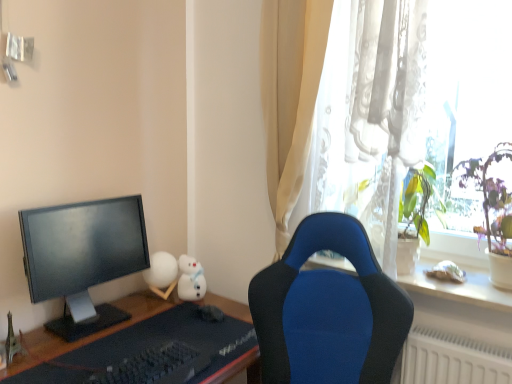
In order to click on free location above black matte desk at lower left (from a real-world perspective) in this screenshot , I will do `click(148, 337)`.